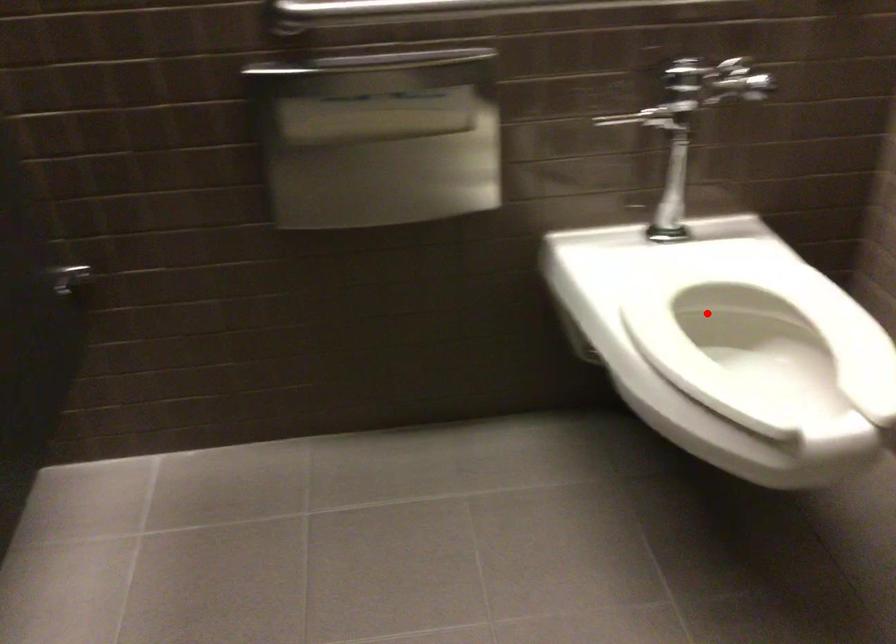
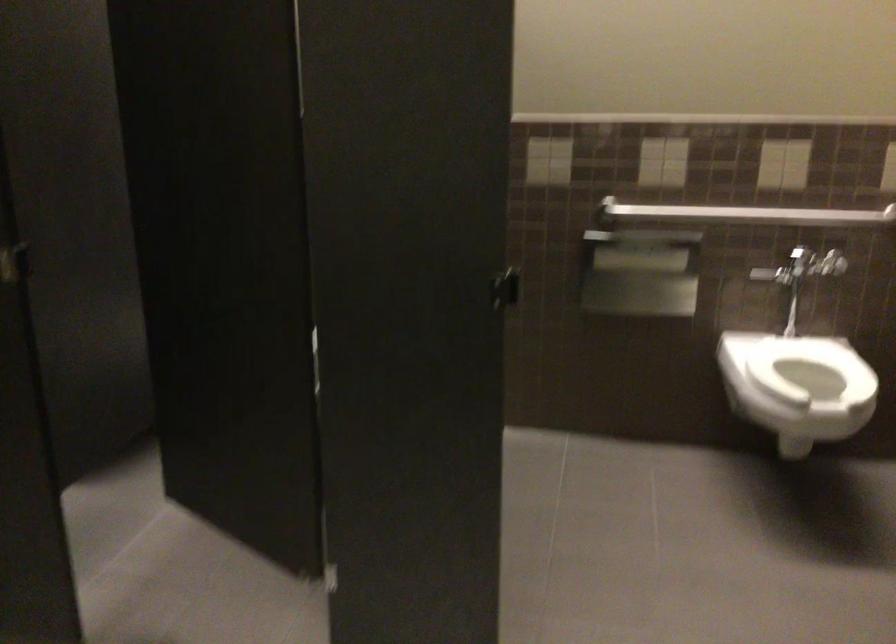
Locate, in the second image, the point that corresponds to the highlighted location in the first image.

(810, 368)